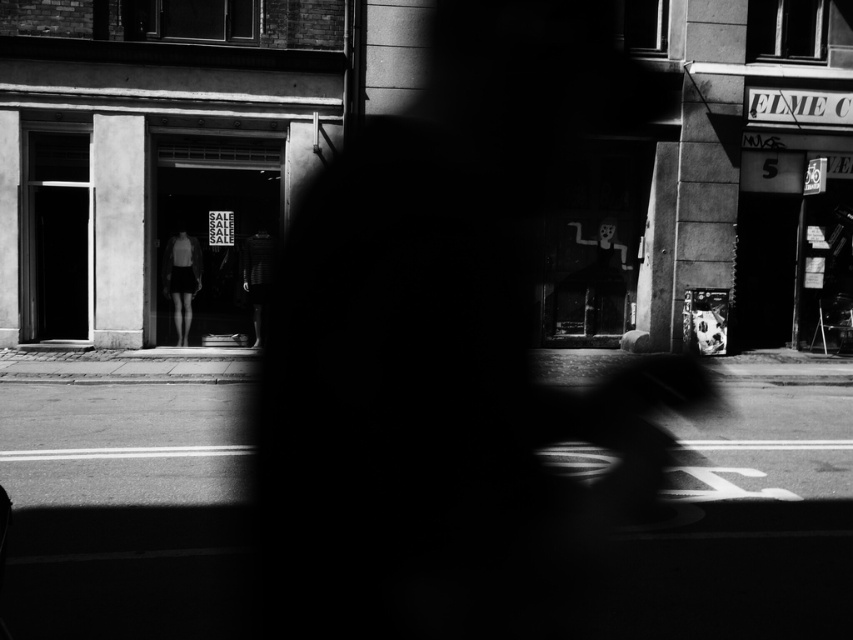
Is smooth black mask at center thinner than smooth skin figure at center?

No.

Does smooth black mask at center appear over smooth skin figure at center?

Indeed, smooth black mask at center is positioned over smooth skin figure at center.

Find the location of a particular element. This screenshot has height=640, width=853. smooth black mask at center is located at coordinates (601, 282).

Who is shorter, smooth skin figure at center or dark textured shirt at center?

dark textured shirt at center

Who is higher up, smooth skin figure at center or dark textured shirt at center?

smooth skin figure at center

Between point (194, 291) and point (259, 282), which one is positioned in front?

Point (259, 282) is more forward.

I want to click on smooth skin figure at center, so click(x=181, y=280).

Which is more to the left, smooth black mask at center or dark textured shirt at center?

dark textured shirt at center

Who is more distant from viewer, (595, 324) or (271, 244)?

The point (595, 324) is behind.

Locate an element on the screen. Image resolution: width=853 pixels, height=640 pixels. smooth black mask at center is located at coordinates (601, 282).